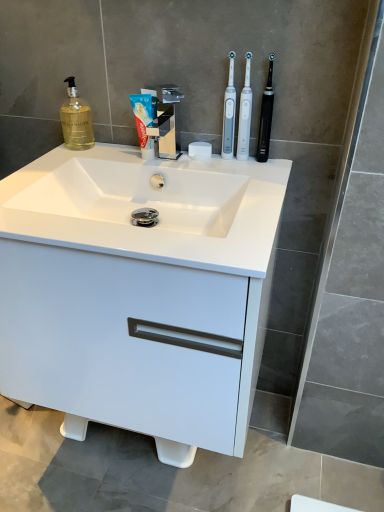
Find the location of a particular element. free spot in front of translucent glass soap dispenser at upper left is located at coordinates (56, 162).